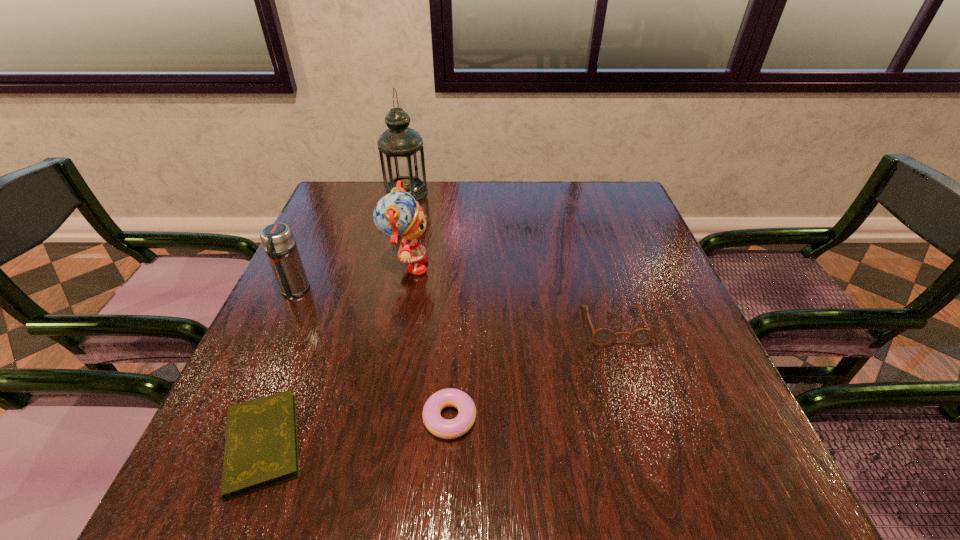
The width and height of the screenshot is (960, 540). In order to click on free space located 0.090m on the face of the doll in this screenshot , I will do `click(467, 268)`.

Locate an element on the screen. This screenshot has width=960, height=540. vacant space located with a handle on the side of the thermos bottle is located at coordinates (225, 441).

This screenshot has width=960, height=540. Find the location of `free spot located 0.240m on the front-facing side of the third nearest object`. free spot located 0.240m on the front-facing side of the third nearest object is located at coordinates (656, 462).

Where is `free space located on the left of the doughnut`? free space located on the left of the doughnut is located at coordinates (367, 418).

You are a GUI agent. You are given a task and a screenshot of the screen. Output one action in this format:
    pyautogui.click(x=<x>, y=<y>)
    Task: Click on the free space located 0.220m on the right of the shortest object
    The image size is (960, 540).
    Given the screenshot: What is the action you would take?
    pyautogui.click(x=442, y=443)

This screenshot has height=540, width=960. Find the location of `object located in the far edge section of the desktop`. object located in the far edge section of the desktop is located at coordinates (401, 152).

Identify the location of object located at the near edge. (261, 444).

Find the location of a particular element. thermos bottle that is at the left edge is located at coordinates (278, 241).

Locate an element on the screen. The image size is (960, 540). diary that is positioned at the left edge is located at coordinates (261, 444).

At what (x,y) coordinates should I click in order to perform the action: click on object present at the right edge. Please return your answer as a coordinate pair (x, y). Image resolution: width=960 pixels, height=540 pixels. Looking at the image, I should click on (602, 337).